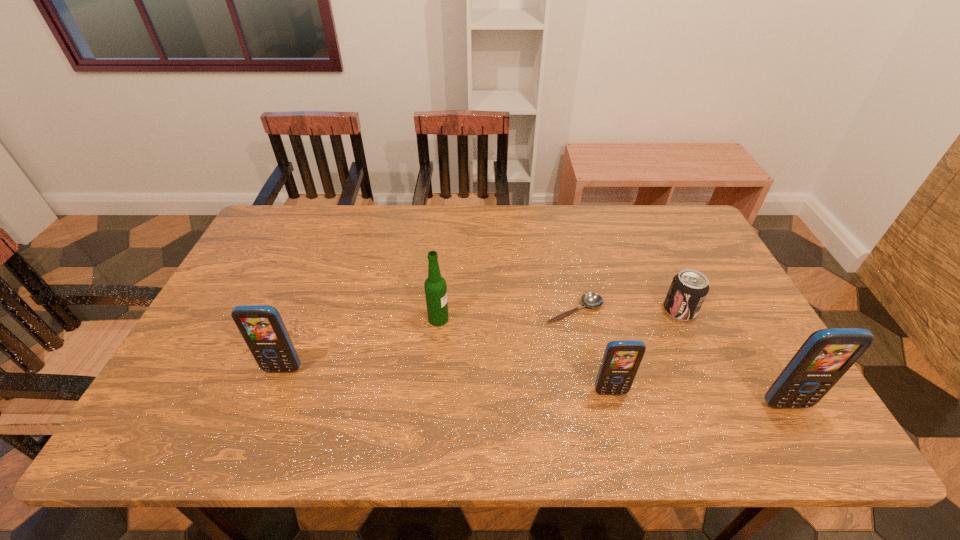
You are a GUI agent. You are given a task and a screenshot of the screen. Output one action in this format:
    pyautogui.click(x=<x>, y=<y>)
    Task: Click on the vacant space at the near left corner
    
    Given the screenshot: What is the action you would take?
    pyautogui.click(x=196, y=388)

Where is `vacant space at the far right corner of the desktop`? This screenshot has width=960, height=540. vacant space at the far right corner of the desktop is located at coordinates (680, 221).

Locate an element on the screen. Image resolution: width=960 pixels, height=540 pixels. vacant space that's between the fourth tallest object and the second object from left to right is located at coordinates (524, 356).

Locate an element on the screen. empty space between the second cellular telephone from right to left and the shortest object is located at coordinates (592, 352).

Identify the location of vacant region between the beer bottle and the leftmost cellular telephone. Image resolution: width=960 pixels, height=540 pixels. (361, 344).

You are a GUI agent. You are given a task and a screenshot of the screen. Output one action in this format:
    pyautogui.click(x=<x>, y=<y>)
    Task: Click on the vacant region between the farthest cellular telephone and the fourth tallest object
    This screenshot has width=960, height=540.
    Given the screenshot: What is the action you would take?
    pyautogui.click(x=446, y=381)

Find the location of a particular element. This screenshot has height=540, width=960. free area in between the farthest cellular telephone and the ladle is located at coordinates (428, 340).

This screenshot has height=540, width=960. Identify the location of vacant space in between the second tallest cellular telephone and the shortest cellular telephone. (446, 381).

The width and height of the screenshot is (960, 540). What are the coordinates of `free space between the leftmost object and the rightmost object` in the screenshot? It's located at (534, 387).

Where is `vacant space that's between the ladle and the fifth tallest object`? The width and height of the screenshot is (960, 540). vacant space that's between the ladle and the fifth tallest object is located at coordinates (627, 310).